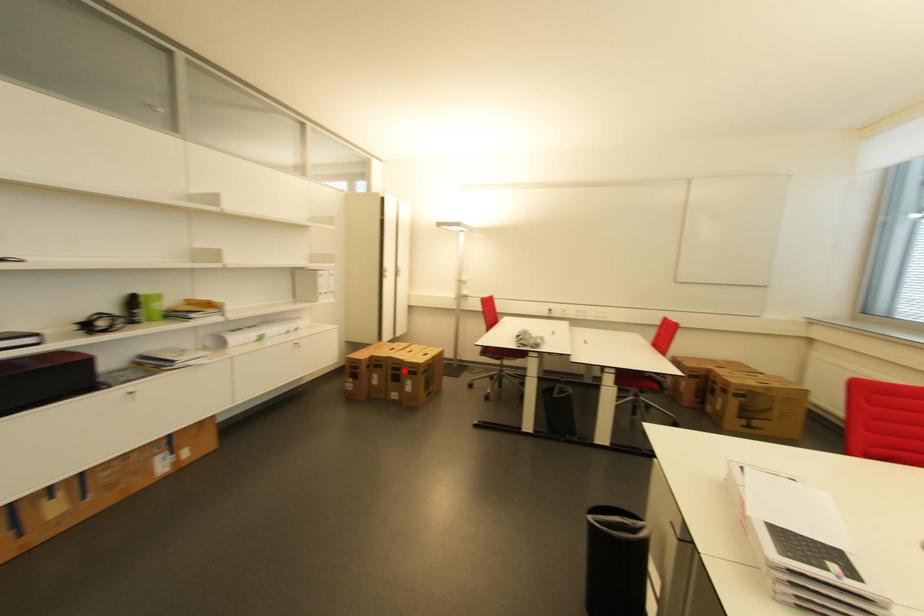
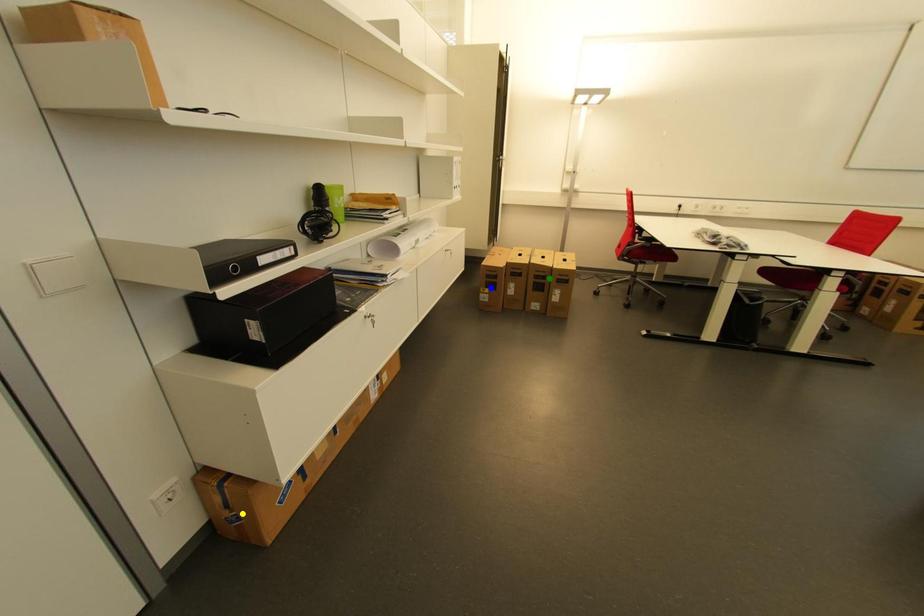
Question: I am providing you with two images of the same scene from different viewpoints. A red point is marked on the first image. You are given multiple points on the second image. Which mark in image 2 goes with the point in image 1?

Choices:
 (A) green point
 (B) yellow point
 (C) blue point

Answer: (A)